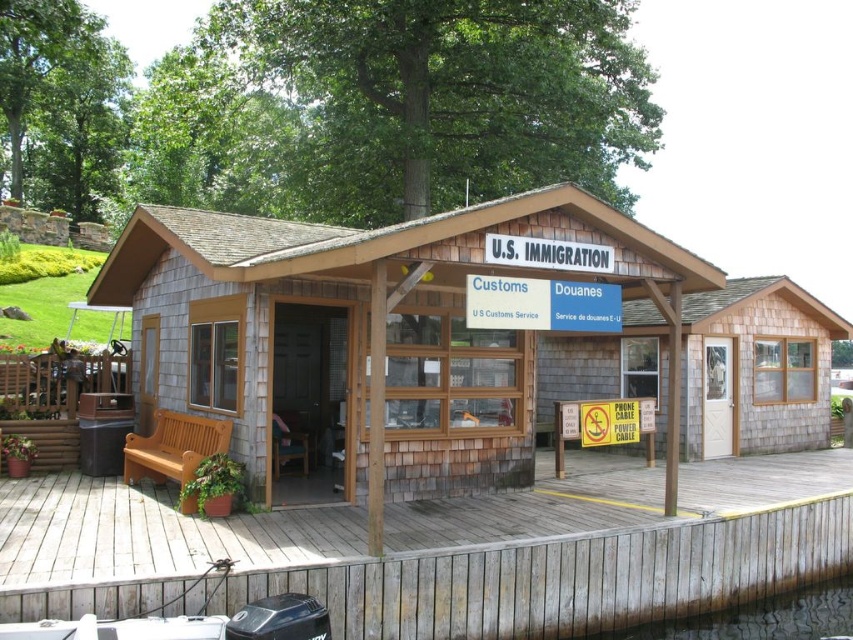
Who is shorter, wooden at center or shingled wood cabin at center?

With less height is shingled wood cabin at center.

Is point (115, 529) closer to viewer compared to point (619, 266)?

Yes, it is in front of point (619, 266).

Who is more forward, [851,566] or [404,244]?

Point [404,244]

The height and width of the screenshot is (640, 853). What are the coordinates of `wooden at center` in the screenshot? It's located at (447, 548).

Between shingled wood cabin at center and clear water at dock lower, which one has less height?

With less height is clear water at dock lower.

Is point (497, 483) positioned behind point (753, 634)?

Yes, it is behind point (753, 634).

You are a GUI agent. You are given a task and a screenshot of the screen. Output one action in this format:
    pyautogui.click(x=<x>, y=<y>)
    Task: Click on the shingled wood cabin at center
    The image size is (853, 640).
    Given the screenshot: What is the action you would take?
    pyautogui.click(x=369, y=326)

Consider the image. Is wooden at center thinner than clear water at dock lower?

No, wooden at center is not thinner than clear water at dock lower.

Does wooden at center appear over clear water at dock lower?

Yes.

Between point (107, 545) and point (657, 627), which one is positioned behind?

Point (657, 627)

Locate an element on the screen. This screenshot has width=853, height=640. wooden at center is located at coordinates (447, 548).